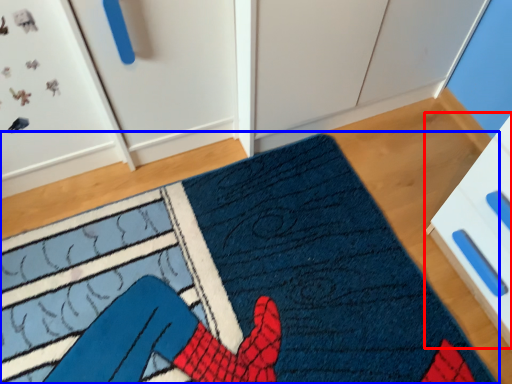
Question: Which point is further to the camera, drawer (highlighted by a red box) or doormat (highlighted by a blue box)?

Choices:
 (A) drawer
 (B) doormat

Answer: (B)